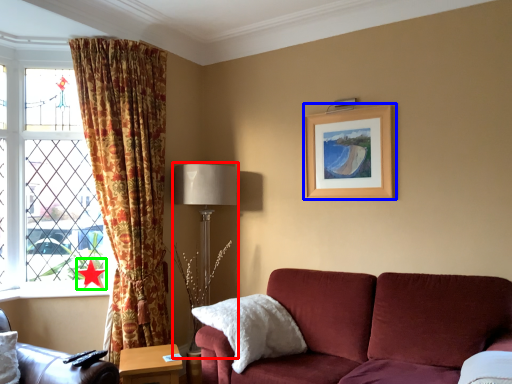
Question: Based on their relative distances, which object is farther from table lamp (highlighted by a red box)? Choose from picture frame (highlighted by a blue box) and star (highlighted by a green box).

Choices:
 (A) picture frame
 (B) star

Answer: (B)